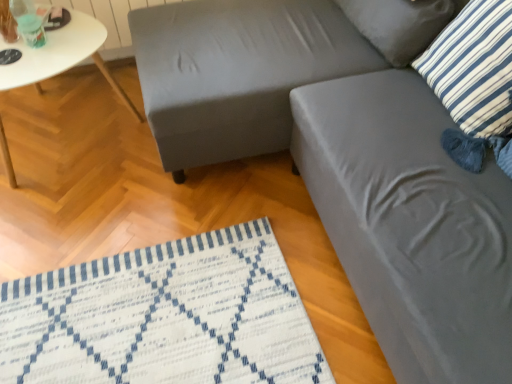
At what (x,y) coordinates should I click in order to perform the action: click on free space above white glossy table at left (from a real-world perspective). Please return your answer as a coordinate pair (x, y). Looking at the image, I should click on click(38, 48).